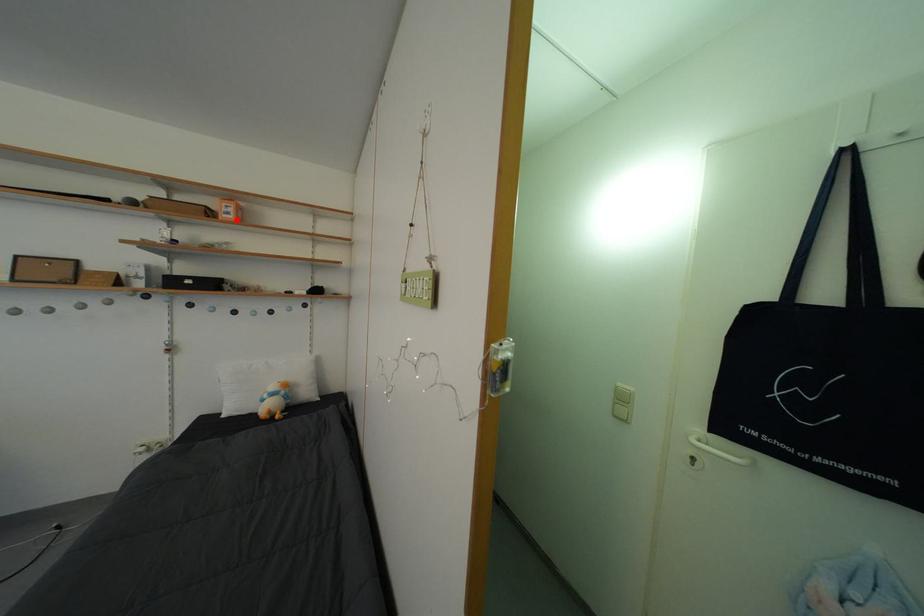
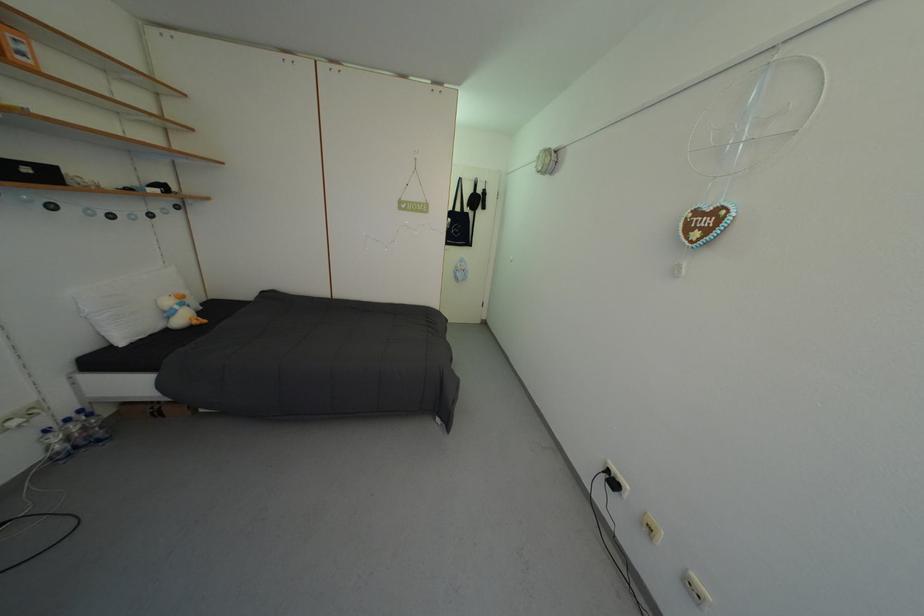
Where in the second image is the point corresponding to the highlighted location from the first image?

(30, 60)